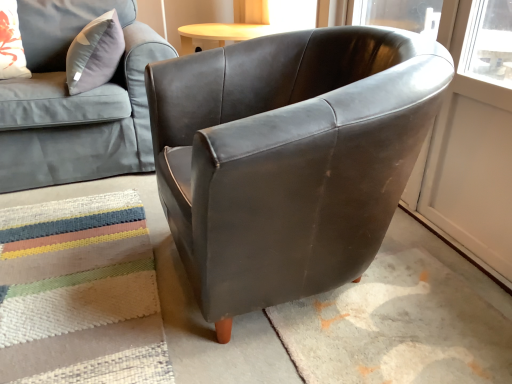
Question: Is textured woven mat at lower left in front of or behind floral fabric pillow at upper left in the image?

Choices:
 (A) behind
 (B) front

Answer: (B)

Question: Choose the correct answer: Is textured woven mat at lower left inside floral fabric pillow at upper left or outside it?

Choices:
 (A) outside
 (B) inside

Answer: (A)

Question: Which is nearer to the textured woven mat at lower left?

Choices:
 (A) floral fabric pillow at upper left
 (B) matte gray fabric couch at upper left
 (C) matte brown leather armchair at center

Answer: (C)

Question: Which object is positioned farthest from the matte brown leather armchair at center?

Choices:
 (A) matte gray fabric couch at upper left
 (B) textured woven mat at lower left
 (C) floral fabric pillow at upper left

Answer: (C)